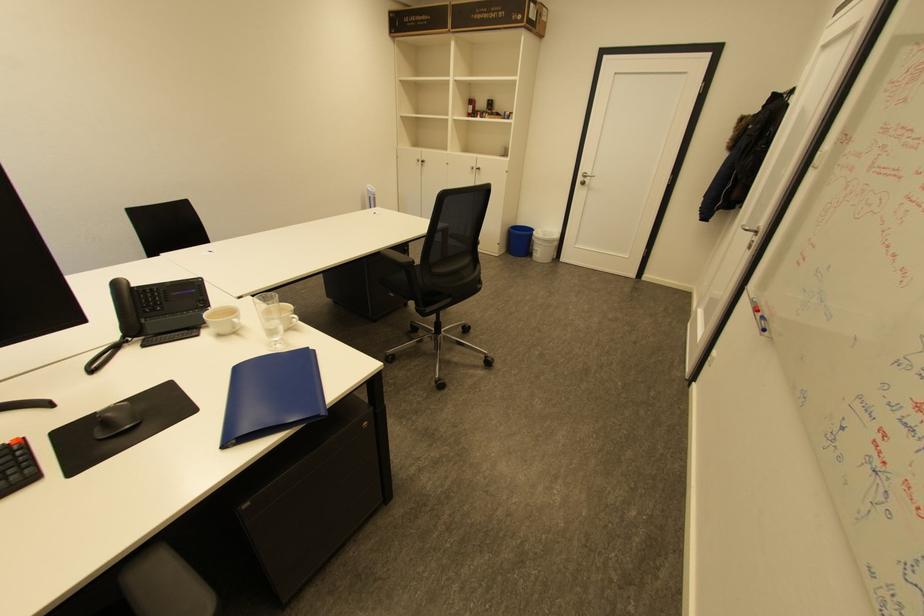
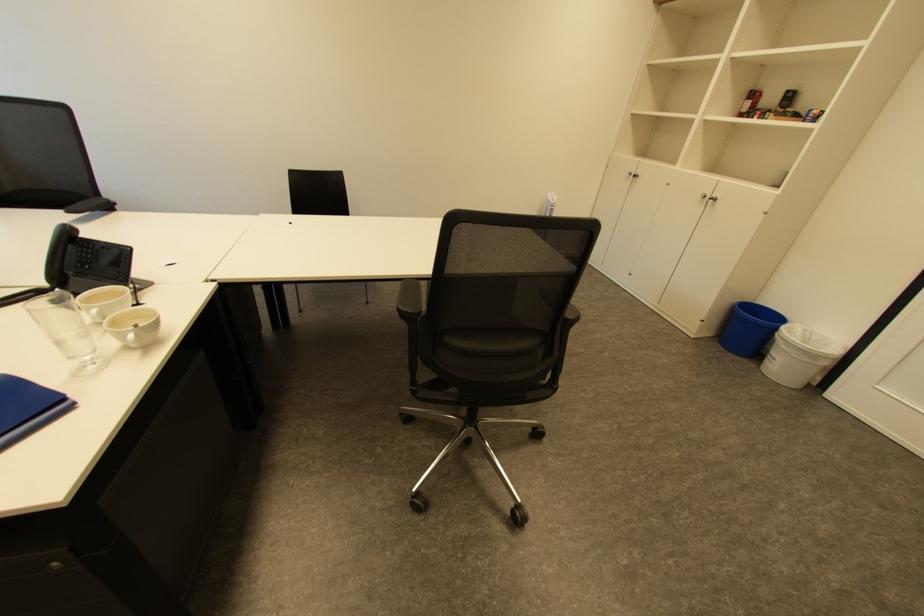
The point at (x=536, y=259) is marked in the first image. Where is the corresponding point in the second image?

(760, 365)